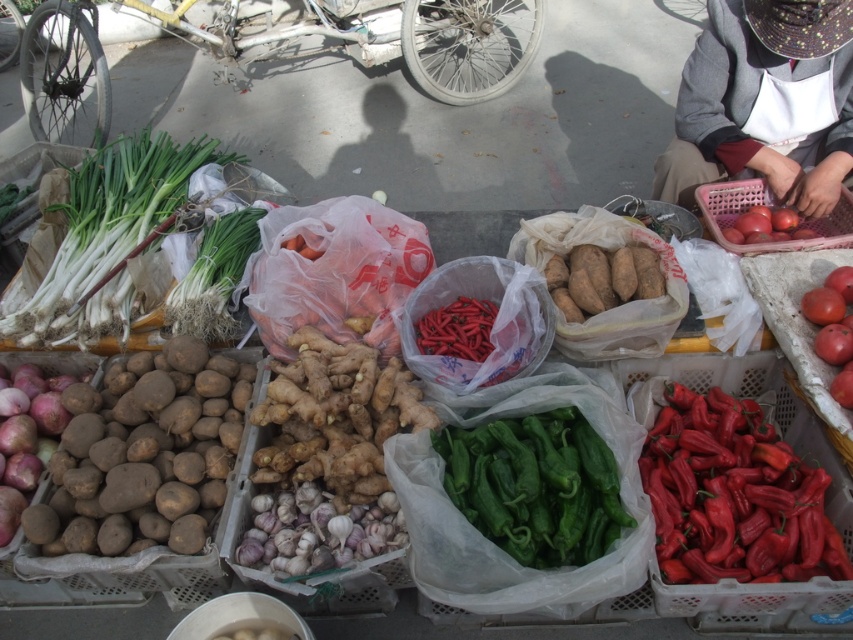
Where is `matte plastic tomatoes at right`? Image resolution: width=853 pixels, height=640 pixels. matte plastic tomatoes at right is located at coordinates (769, 205).

Is point (763, 250) less distant than point (840, 371)?

No, (763, 250) is further to viewer.

Identify the location of matte plastic tomatoes at right. (769, 205).

Identify the location of matte plastic tomatoes at right. Image resolution: width=853 pixels, height=640 pixels. (769, 205).

Is point (219, 259) farther from camera compared to point (753, 204)?

No, it is not.

Who is more forward, [213,310] or [708,196]?

Point [213,310] is in front.

This screenshot has height=640, width=853. I want to click on green leafy at center, so click(213, 276).

Does white cotton apron at upper right appear on the left side of red matte tomato at center right?

Indeed, white cotton apron at upper right is positioned on the left side of red matte tomato at center right.

The image size is (853, 640). What do you see at coordinates (764, 102) in the screenshot? I see `white cotton apron at upper right` at bounding box center [764, 102].

Is point (682, 188) in front of point (846, 349)?

No, (682, 188) is behind (846, 349).

Locate an element on the screen. This screenshot has height=640, width=853. white cotton apron at upper right is located at coordinates (764, 102).